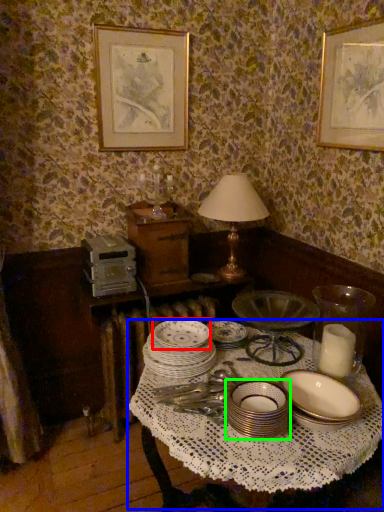
Question: Considering the real-world distances, which object is farthest from platter (highlighted by a red box)? round table (highlighted by a blue box) or tableware (highlighted by a green box)?

Choices:
 (A) round table
 (B) tableware

Answer: (B)